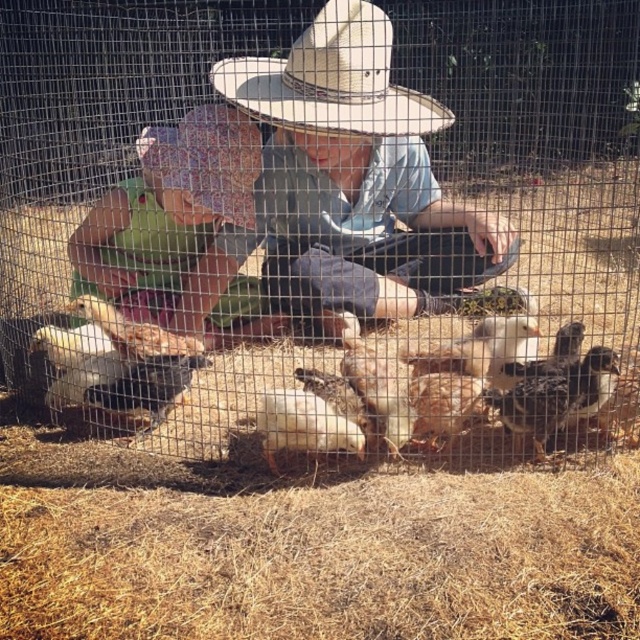
You are standing at the origin point of the image coordinate system. The light brown straw hat at center is located at point (358, 172). If you want to move towards the light brown straw hat at center, in which direction should you move?

To move towards the light brown straw hat at center located at point (358, 172) from the origin, you should move in the positive x and positive y direction since both coordinates are greater than zero.

You are a photographer trying to capture a clear photo of both the light brown straw hat at center and the white fluffy chicken at center. Given their height difference, which one will appear larger in the photo?

The light brown straw hat at center is much taller than the white fluffy chicken at center, so it will appear larger in the photo.

Based on the photo, you are a photographer trying to capture a clear photo of both the white fluffy chicken at center and the white feathered chicken at center. Since the fence is partially blocking the view, you need to adjust your position. Which chicken should you move closer to in order to get both in the frame without the fence blocking them?

To capture both the white fluffy chicken at center and the white feathered chicken at center without the fence blocking them, you should move closer to the white feathered chicken at center. Since the white fluffy chicken at center is positioned on the right side of the white feathered chicken at center, moving towards the left side of the white feathered chicken would allow both chickens to be within the frame while minimizing fence obstruction.